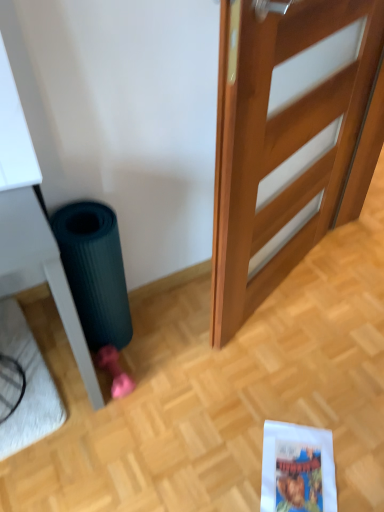
Where is `free space behind blue glossy comic book at lower right`? free space behind blue glossy comic book at lower right is located at coordinates (286, 398).